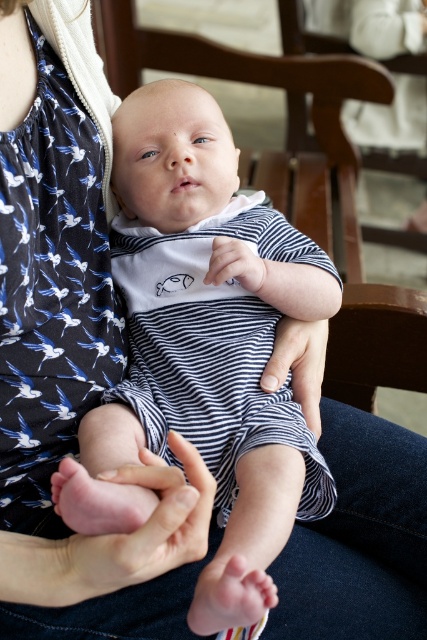
Is point (248, 339) behind point (300, 387)?

No, it is in front of (300, 387).

Can you confirm if striped cotton onesie at center is positioned below matte striped fabric at center?

Incorrect, striped cotton onesie at center is not positioned below matte striped fabric at center.

Which is in front, point (266, 490) or point (312, 369)?

Point (266, 490) is in front.

Locate an element on the screen. striped cotton onesie at center is located at coordinates (201, 352).

Is striped cotton onesie at center in front of white soft fabric hand at center?

Yes, it is.

Does striped cotton onesie at center have a lesser width compared to white soft fabric hand at center?

No, striped cotton onesie at center is not thinner than white soft fabric hand at center.

Where is `striped cotton onesie at center`? The image size is (427, 640). striped cotton onesie at center is located at coordinates (201, 352).

Locate an element on the screen. The width and height of the screenshot is (427, 640). striped cotton onesie at center is located at coordinates (201, 352).

Can you confirm if striped cotton onesie at center is positioned to the right of pink flesh at center?

Yes, striped cotton onesie at center is to the right of pink flesh at center.

Who is more forward, [190,321] or [119,564]?

Point [119,564] is more forward.

The width and height of the screenshot is (427, 640). What do you see at coordinates (201, 352) in the screenshot?
I see `striped cotton onesie at center` at bounding box center [201, 352].

Locate an element on the screen. striped cotton onesie at center is located at coordinates [201, 352].